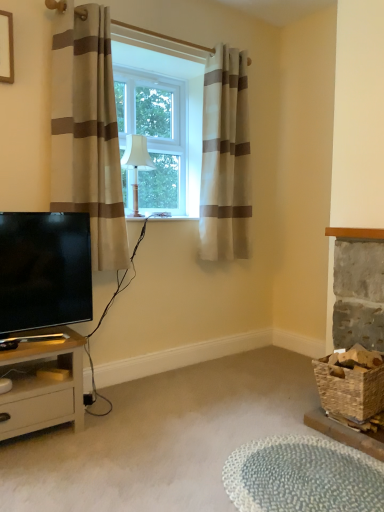
At what (x,y) coordinates should I click in order to perform the action: click on vacant space in front of rustic woven basket at lower right. Please return your answer as a coordinate pair (x, y). This screenshot has height=512, width=384. Looking at the image, I should click on (348, 453).